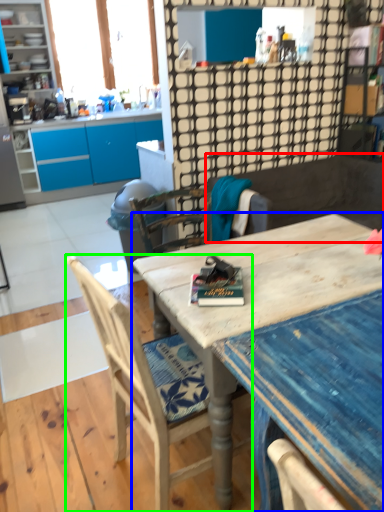
Question: Which object is the farthest from wide (highlighted by a red box)? Choose among these: desk (highlighted by a blue box) or chair (highlighted by a green box).

Choices:
 (A) desk
 (B) chair

Answer: (B)